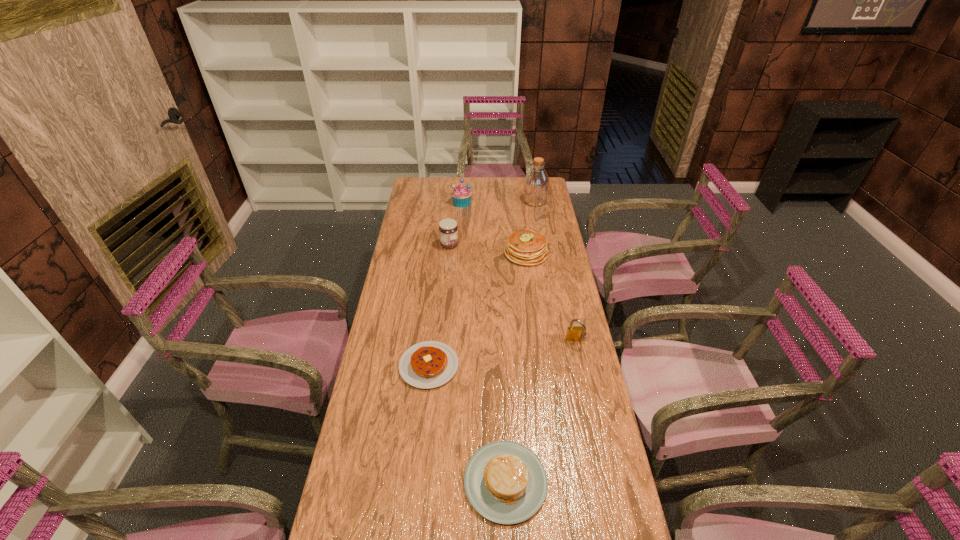
Where is `free space between the farthest pancake and the jam`? The image size is (960, 540). free space between the farthest pancake and the jam is located at coordinates [488, 249].

Locate an element on the screen. Image resolution: width=960 pixels, height=540 pixels. empty space between the tallest object and the shortest pancake is located at coordinates (482, 284).

Identify the location of free space between the tallest pancake and the padlock. The height and width of the screenshot is (540, 960). (551, 298).

You are a GUI agent. You are given a task and a screenshot of the screen. Output one action in this format:
    pyautogui.click(x=<x>, y=<y>)
    Task: Click on the vacant space that is in between the bottle and the jam
    The image size is (960, 540).
    Given the screenshot: What is the action you would take?
    pyautogui.click(x=492, y=223)

Identify the location of vacant space that's between the muffin and the padlock. (518, 272).

I want to click on free space between the jam and the bottle, so click(x=492, y=223).

This screenshot has height=540, width=960. Find the location of `free point between the padlock and the second farthest pancake`. free point between the padlock and the second farthest pancake is located at coordinates (502, 354).

Identify which object is the sixth closest to the second nearest pancake. Please provide its 2D coordinates. Your answer should be formatted as a tuple, i.e. [(x, y)], where the tuple contains the x and y coordinates of a point satisfying the conditions above.

[(536, 184)]

You are a GUI agent. You are given a task and a screenshot of the screen. Output one action in this format:
    pyautogui.click(x=<x>, y=<y>)
    Task: Click on the object that is the fifth nearest to the farthest pancake
    Image resolution: width=960 pixels, height=540 pixels.
    Given the screenshot: What is the action you would take?
    pyautogui.click(x=429, y=364)

Identify which pancake is located as the nearest to the muffin. Please provide its 2D coordinates. Your answer should be formatted as a tuple, i.e. [(x, y)], where the tuple contains the x and y coordinates of a point satisfying the conditions above.

[(525, 247)]